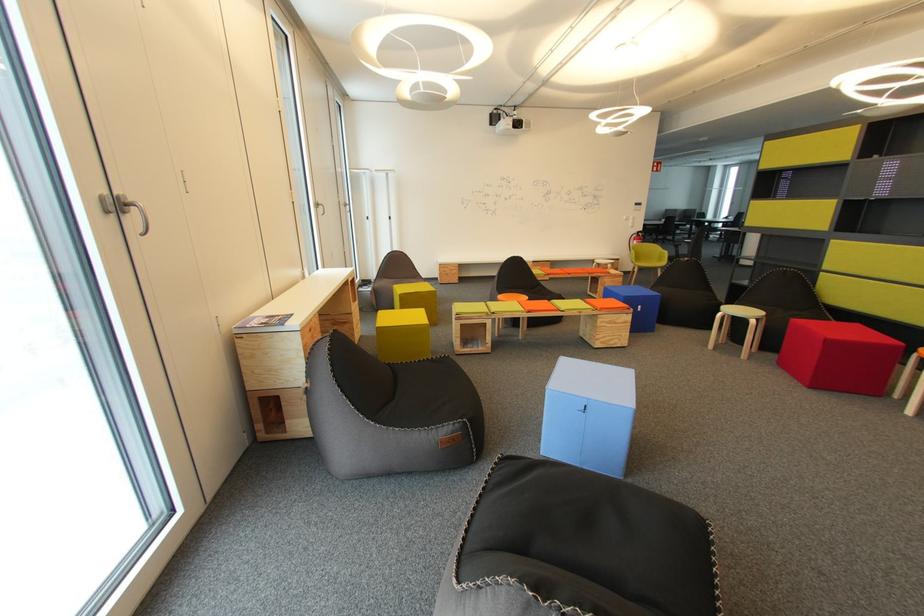
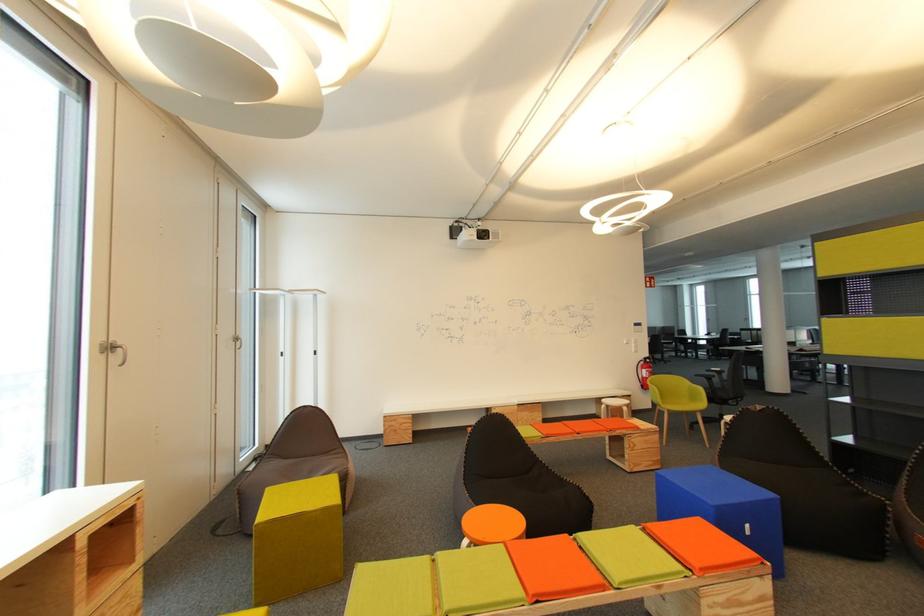
Question: Which direction would the cameraman need to move to produce the second image? Reply with the corresponding letter.

Choices:
 (A) Left
 (B) Right
 (C) Forward
 (D) Backward

Answer: (C)